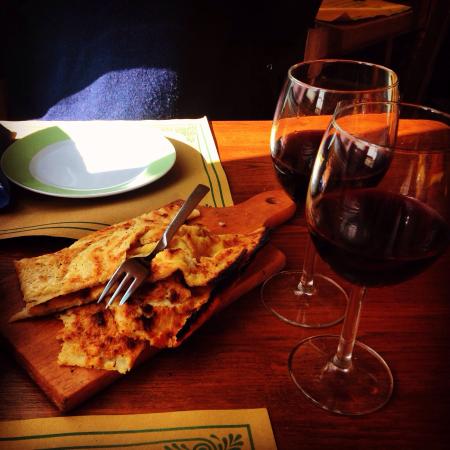
You are a GUI agent. You are given a task and a screenshot of the screen. Output one action in this format:
    pyautogui.click(x=<x>, y=<y>)
    Task: Click on the paper placemat
    
    Given the screenshot: What is the action you would take?
    pyautogui.click(x=66, y=216), pyautogui.click(x=178, y=430)